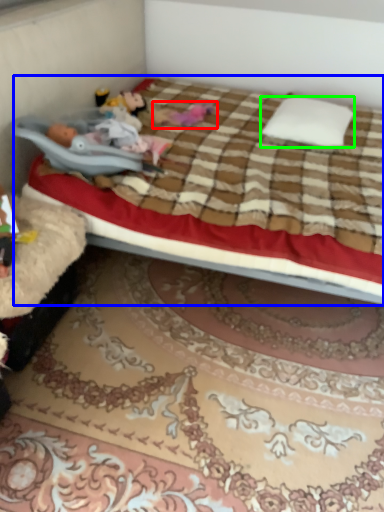
Question: Which object is positioned closest to toy (highlighted by a red box)? Select from bed (highlighted by a blue box) and pillow (highlighted by a green box).

Choices:
 (A) bed
 (B) pillow

Answer: (B)